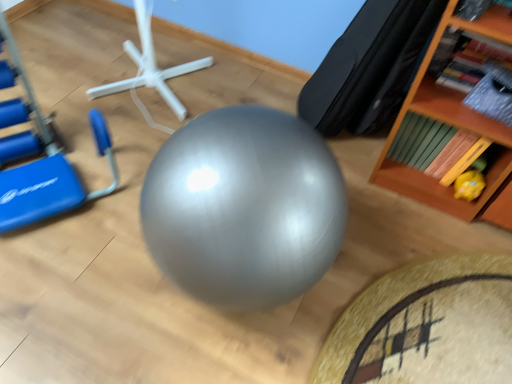
The image size is (512, 384). I want to click on free space in front of wooden bookshelf at upper right, so click(x=431, y=243).